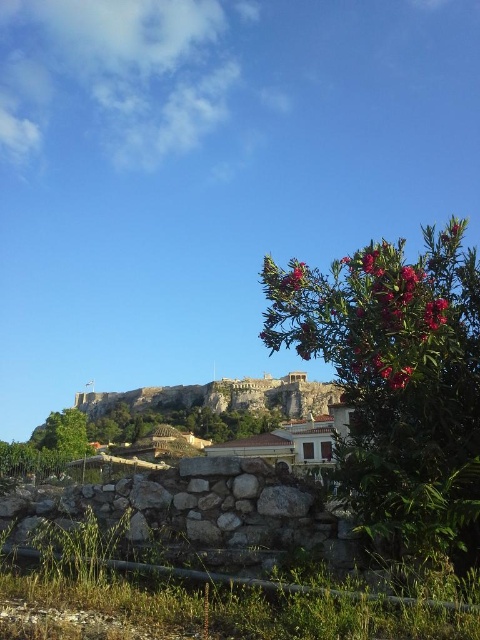
Question: Which object appears farthest from the camera in this image?

Choices:
 (A) pink leafy bush at right
 (B) pink matte flower at upper right

Answer: (B)

Question: Considering the relative positions of pink leafy bush at right and pink matte flower at upper right in the image provided, where is pink leafy bush at right located with respect to pink matte flower at upper right?

Choices:
 (A) below
 (B) above

Answer: (A)

Question: Is pink leafy bush at right behind pink matte flower at upper right?

Choices:
 (A) no
 (B) yes

Answer: (A)

Question: Is pink leafy bush at right to the right of pink matte flower at upper right from the viewer's perspective?

Choices:
 (A) yes
 (B) no

Answer: (B)

Question: Which of the following is the farthest from the observer?

Choices:
 (A) (432, 310)
 (B) (475, 486)

Answer: (A)

Question: Which object appears farthest from the camera in this image?

Choices:
 (A) pink leafy bush at right
 (B) pink matte flower at upper right

Answer: (B)